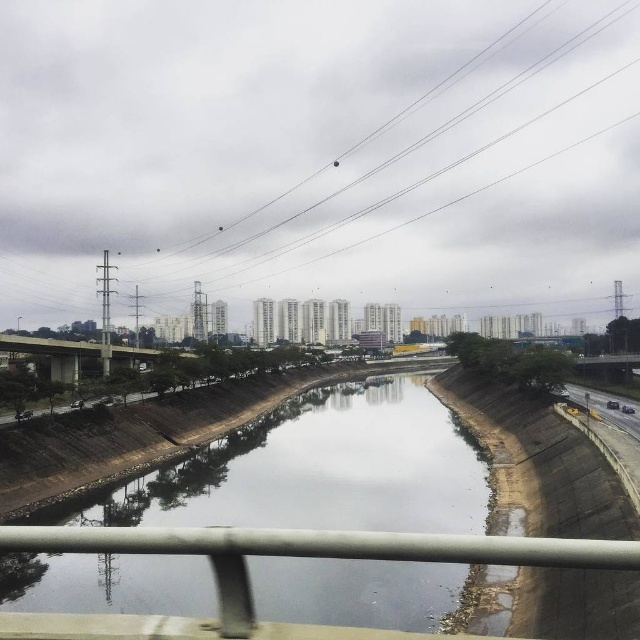
Consider the image. Does clear concrete river at center appear on the right side of metallic wire at upper center?

No, clear concrete river at center is not to the right of metallic wire at upper center.

Does point (403, 488) come farther from viewer compared to point (170, 273)?

No.

Who is more distant from viewer, (196, 456) or (420, 180)?

The point (420, 180) is behind.

Where is `clear concrete river at center`? clear concrete river at center is located at coordinates (320, 468).

How much distance is there between metallic wire at upper center and concrete bridge at center?

metallic wire at upper center is 180.45 meters away from concrete bridge at center.

Between point (625, 16) and point (58, 352), which one is positioned behind?

The point (625, 16) is behind.

I want to click on metallic wire at upper center, so click(433, 129).

Where is `metallic wire at upper center`? The image size is (640, 640). metallic wire at upper center is located at coordinates (433, 129).

Is clear concrete river at center taller than concrete bridge at center?

Indeed, clear concrete river at center has a greater height compared to concrete bridge at center.

How far apart are clear concrete river at center and concrete bridge at center?

A distance of 30.76 meters exists between clear concrete river at center and concrete bridge at center.

Describe the element at coordinates (320, 468) in the screenshot. I see `clear concrete river at center` at that location.

This screenshot has width=640, height=640. Find the location of `clear concrete river at center`. clear concrete river at center is located at coordinates (320, 468).